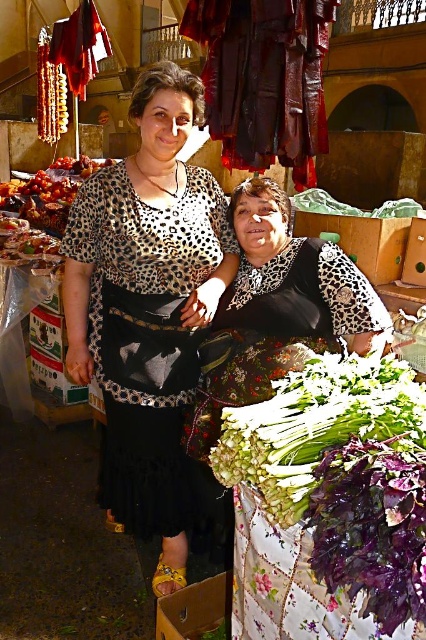
Can you confirm if leopard print blouse at center is shorter than green leafy vegetables at lower right?

No, leopard print blouse at center is not shorter than green leafy vegetables at lower right.

The width and height of the screenshot is (426, 640). Describe the element at coordinates (147, 308) in the screenshot. I see `leopard print blouse at center` at that location.

Image resolution: width=426 pixels, height=640 pixels. What do you see at coordinates (147, 308) in the screenshot? I see `leopard print blouse at center` at bounding box center [147, 308].

Where is `leopard print blouse at center`? The image size is (426, 640). leopard print blouse at center is located at coordinates (147, 308).